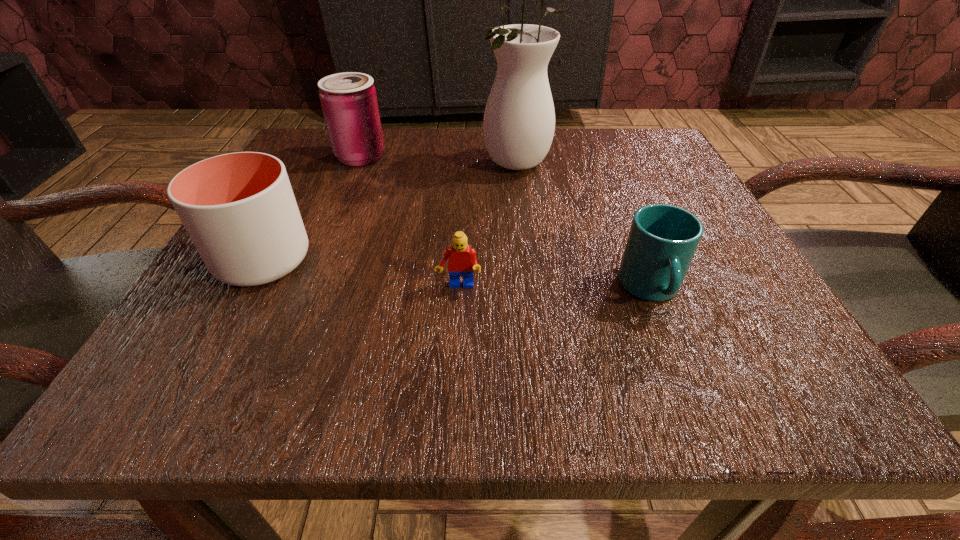
Where is `vacant space that is in between the can and the tallest object`? vacant space that is in between the can and the tallest object is located at coordinates (440, 161).

Find the location of a particular element. unoccupied area between the second object from right to left and the can is located at coordinates (440, 161).

Where is `vacant point located between the third object from left to right and the can`? This screenshot has width=960, height=540. vacant point located between the third object from left to right and the can is located at coordinates (410, 222).

Select which object appears as the fourth closest to the can. Please provide its 2D coordinates. Your answer should be formatted as a tuple, i.e. [(x, y)], where the tuple contains the x and y coordinates of a point satisfying the conditions above.

[(662, 241)]

Find the location of a particular element. The width and height of the screenshot is (960, 540). object that ranks as the fourth closest to the right cup is located at coordinates (349, 102).

Image resolution: width=960 pixels, height=540 pixels. I want to click on free location that satisfies the following two spatial constraints: 1. on the front side of the tallest object; 2. on the right side of the can, so click(x=357, y=165).